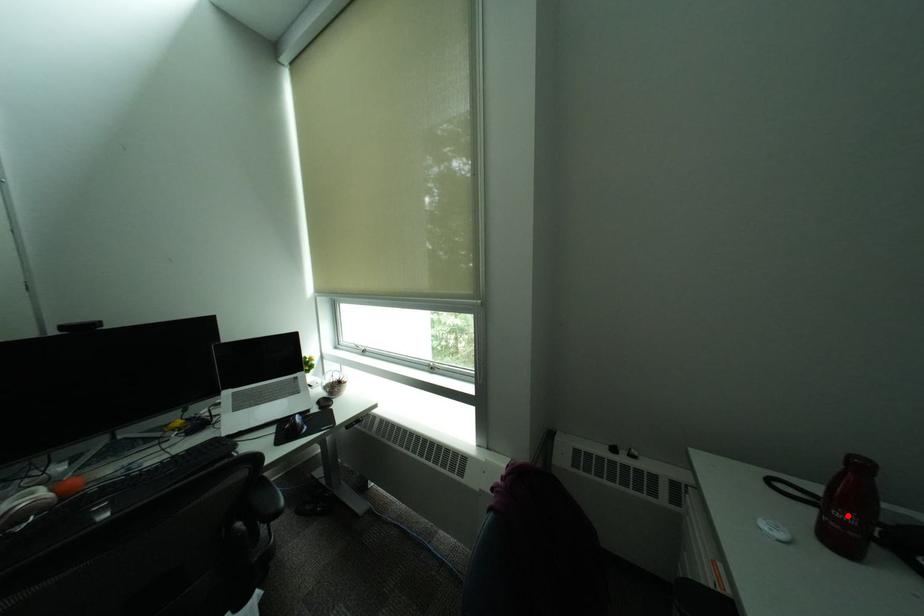
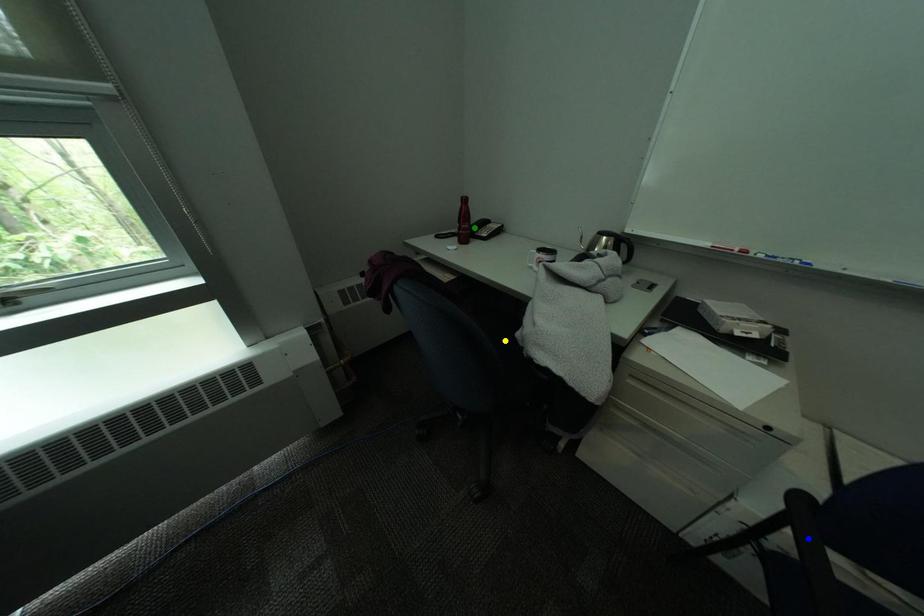
Question: I am providing you with two images of the same scene from different viewpoints. A red point is marked on the first image. You are given multiple points on the second image. In image 2, which mark is for the same physical point as the one in image 1?

Choices:
 (A) blue point
 (B) yellow point
 (C) green point

Answer: (C)